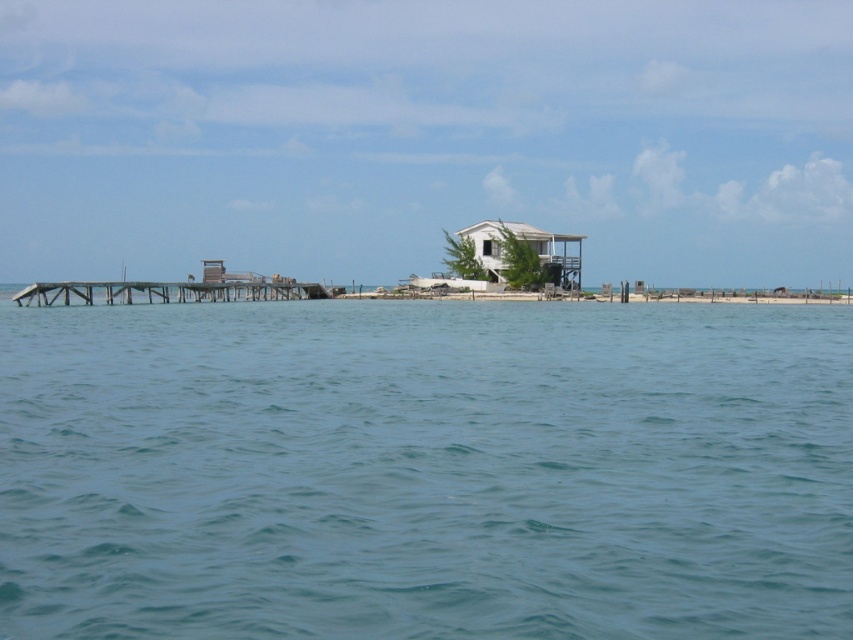
Question: Which point appears closest to the camera in this image?

Choices:
 (A) (270, 292)
 (B) (558, 512)
 (C) (537, 240)

Answer: (B)

Question: Based on their relative distances, which object is farther from the wooden pier at left?

Choices:
 (A) clear blue water at center
 (B) white matte house at center

Answer: (A)

Question: Estimate the real-world distances between objects in this image. Which object is closer to the white matte house at center?

Choices:
 (A) wooden pier at left
 (B) clear blue water at center

Answer: (A)

Question: Is clear blue water at center below white matte house at center?

Choices:
 (A) no
 (B) yes

Answer: (B)

Question: Does wooden pier at left appear over white matte house at center?

Choices:
 (A) no
 (B) yes

Answer: (A)

Question: Can you confirm if clear blue water at center is smaller than wooden pier at left?

Choices:
 (A) yes
 (B) no

Answer: (B)